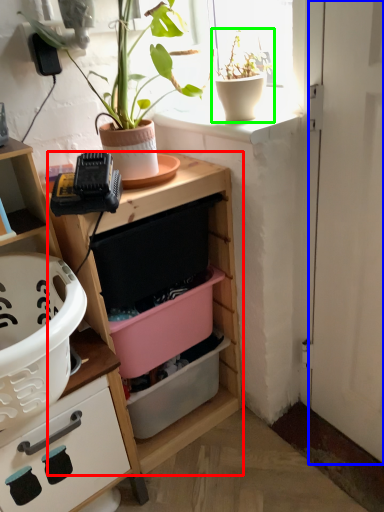
Question: Which object is the closest to the shelf (highlighted by a red box)? Choose among these: door (highlighted by a blue box) or houseplant (highlighted by a green box).

Choices:
 (A) door
 (B) houseplant

Answer: (A)